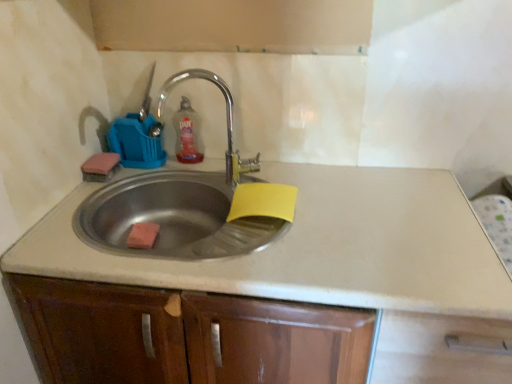
Where is `vacant point to the right of translucent plastic bottle at upper center`? The image size is (512, 384). vacant point to the right of translucent plastic bottle at upper center is located at coordinates (232, 165).